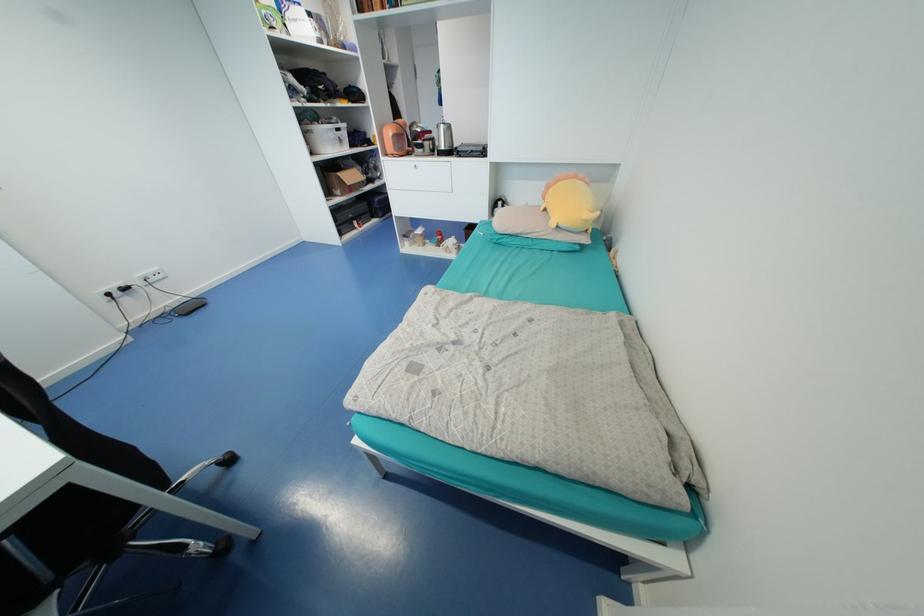
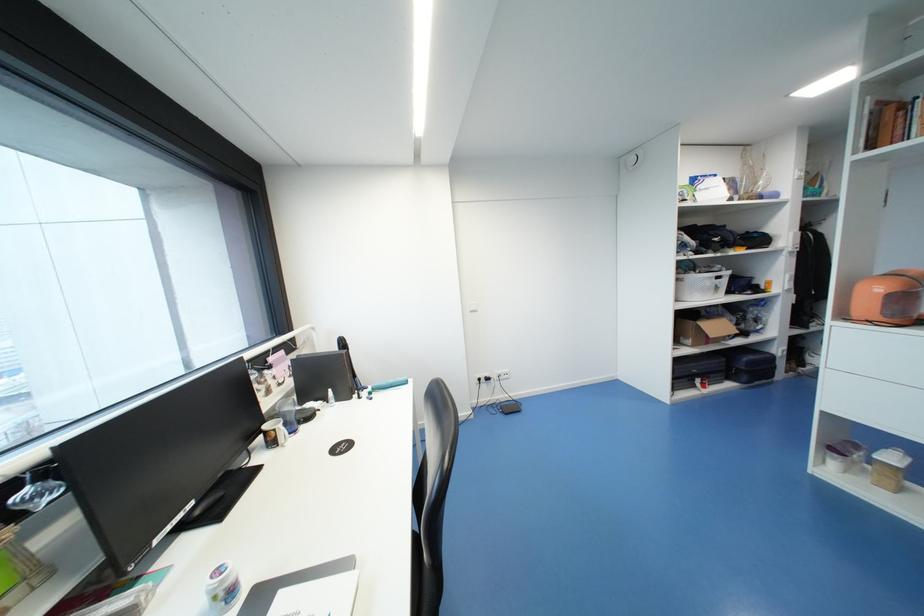
Find the pixel in the second image that matches pixel 345 140 in the first image.

(721, 288)